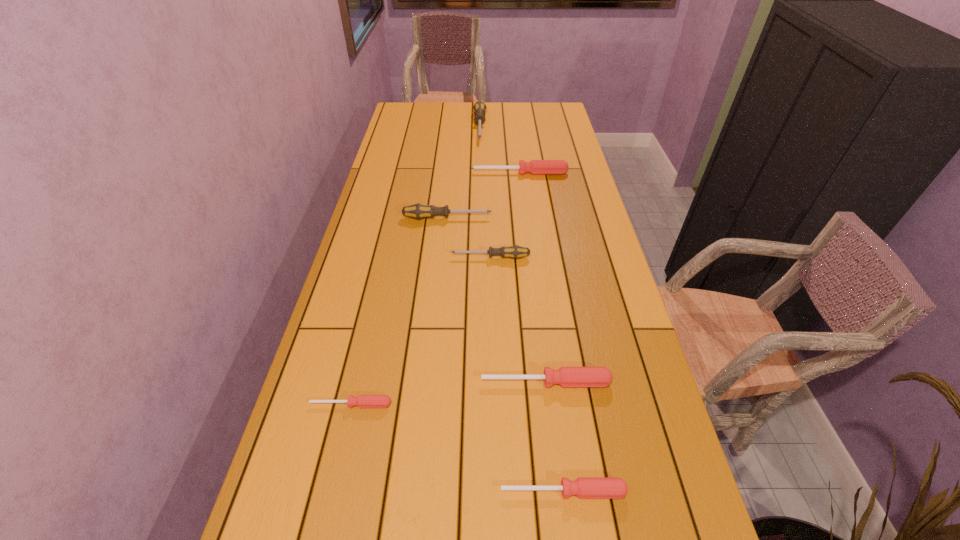
Find the location of a particular element. The height and width of the screenshot is (540, 960). the tallest screwdriver is located at coordinates (479, 108).

I want to click on the farthest gray screwdriver, so click(479, 108).

Find the location of a particular element. the second biggest gray screwdriver is located at coordinates (417, 211).

I want to click on the third farthest object, so click(x=417, y=211).

Locate an element on the screen. This screenshot has width=960, height=540. the sixth nearest screwdriver is located at coordinates (535, 167).

This screenshot has width=960, height=540. Find the location of `the sixth nearest object`. the sixth nearest object is located at coordinates (535, 167).

Where is `the nearest gray screwdriver`? The image size is (960, 540). the nearest gray screwdriver is located at coordinates (515, 251).

Find the location of a particular element. This screenshot has height=540, width=960. the smallest gray screwdriver is located at coordinates (515, 251).

This screenshot has height=540, width=960. What are the coordinates of `the second biggest red screwdriver` in the screenshot? It's located at (566, 376).

This screenshot has width=960, height=540. Find the location of `the third nearest red screwdriver`. the third nearest red screwdriver is located at coordinates (566, 376).